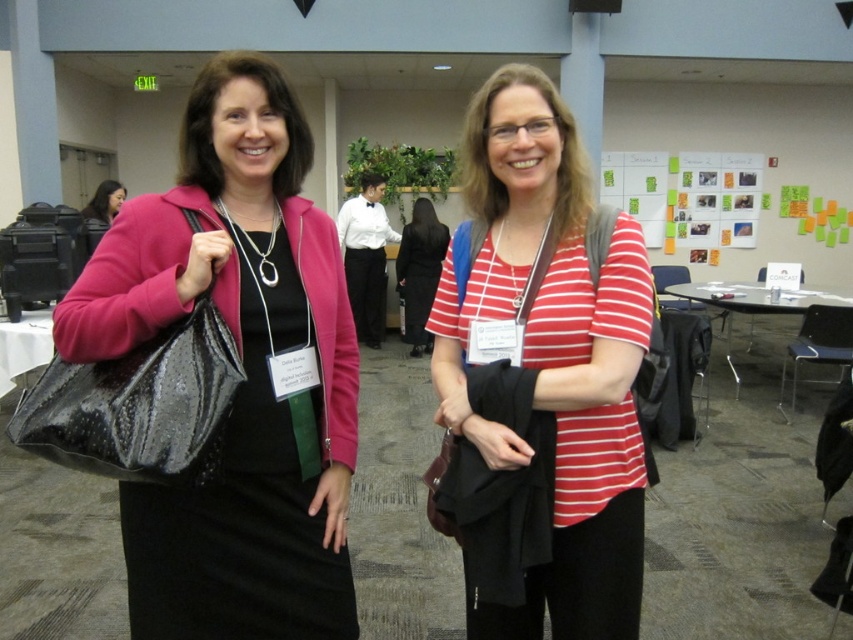
Question: Does striped cotton shirt at center have a larger size compared to matte black hair at upper left?

Choices:
 (A) no
 (B) yes

Answer: (B)

Question: Does shiny black bag at left appear over black dress at center?

Choices:
 (A) no
 (B) yes

Answer: (A)

Question: Estimate the real-world distances between objects in this image. Which object is farther from the shiny black bag at left?

Choices:
 (A) matte black hair at upper left
 (B) black dress at center
 (C) striped cotton shirt at center

Answer: (B)

Question: Estimate the real-world distances between objects in this image. Which object is closer to the shiny black bag at left?

Choices:
 (A) striped cotton shirt at center
 (B) black dress at center
 (C) matte black hair at upper left

Answer: (A)

Question: Estimate the real-world distances between objects in this image. Which object is closer to the matte black hair at upper left?

Choices:
 (A) striped cotton shirt at center
 (B) black dress at center

Answer: (B)

Question: Is striped cotton shirt at center to the left of black dress at center from the viewer's perspective?

Choices:
 (A) no
 (B) yes

Answer: (A)